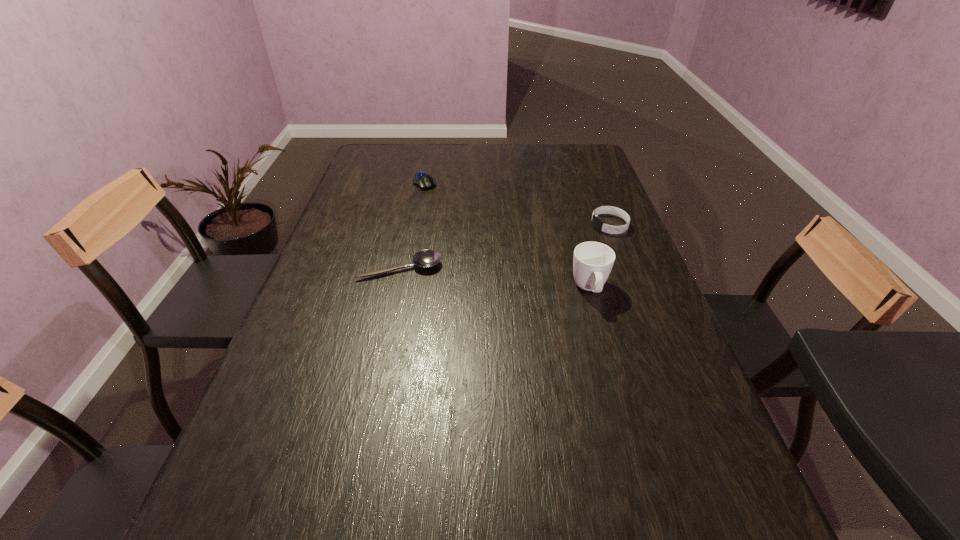
Find the location of a particular element. free space located 0.090m on the button side of the third tallest object is located at coordinates (437, 202).

Identify the location of vacant space situated 0.340m on the button side of the third tallest object. 463,244.

This screenshot has width=960, height=540. Find the location of `vacant area located 0.160m on the outer surface of the third nearest object`. vacant area located 0.160m on the outer surface of the third nearest object is located at coordinates (552, 246).

Locate an element on the screen. vacant space located on the outer surface of the third nearest object is located at coordinates (540, 249).

Identify the location of vacant space located on the outer surface of the third nearest object. (560, 242).

Locate an element on the screen. Image resolution: width=960 pixels, height=540 pixels. object at the left edge is located at coordinates (425, 258).

Locate an element on the screen. cup at the right edge is located at coordinates (592, 263).

Locate an element on the screen. The width and height of the screenshot is (960, 540). wristband that is positioned at the right edge is located at coordinates (597, 223).

At what (x,y) coordinates should I click in order to perform the action: click on vacant region at the far edge of the desktop. Please return your answer as a coordinate pair (x, y). The height and width of the screenshot is (540, 960). Looking at the image, I should click on (496, 158).

In the image, there is a desktop. Identify the location of free space at the near edge. This screenshot has height=540, width=960. (423, 491).